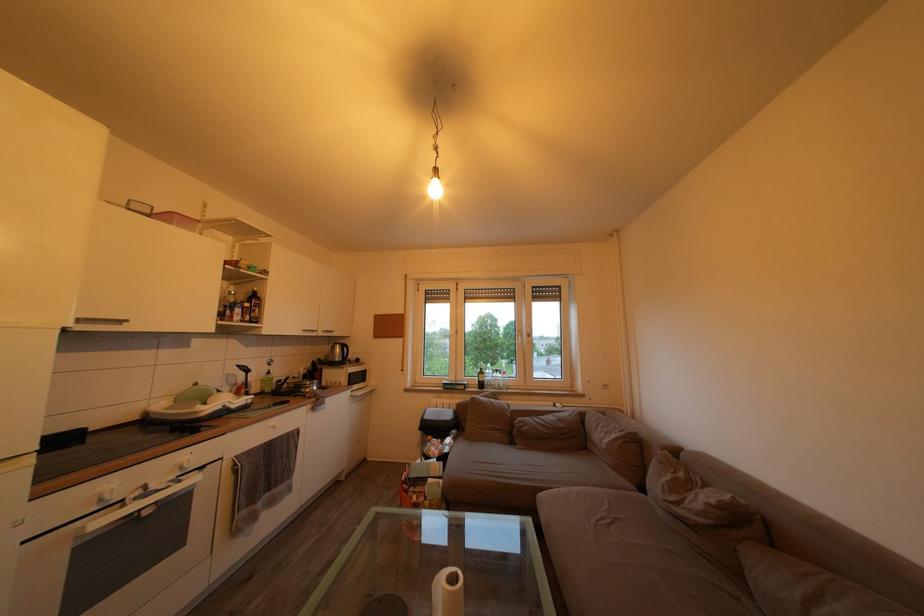
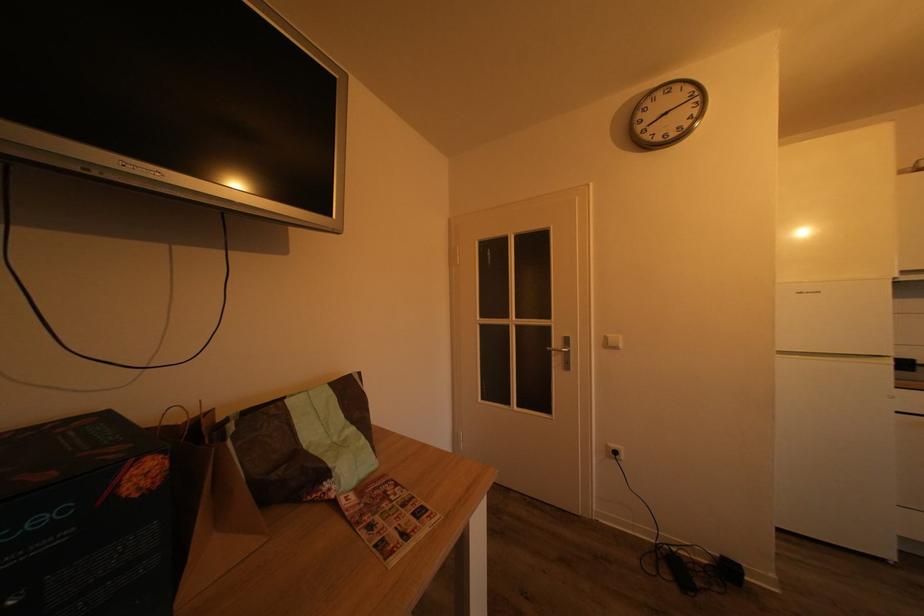
Question: The camera is either moving clockwise (left) or counter-clockwise (right) around the object. The first image is from the beginning of the video and the second image is from the end. Is the camera moving left or right when shooting the video?

Choices:
 (A) Left
 (B) Right

Answer: (B)